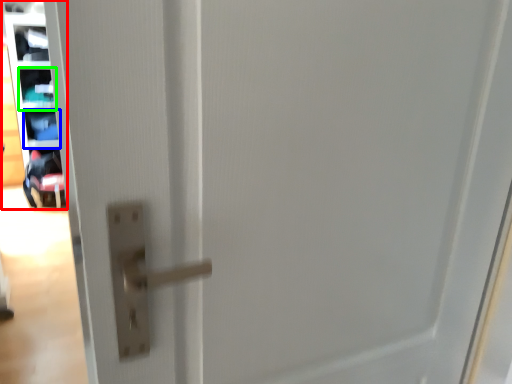
Question: Which object is positioned farthest from shelf (highlighted by a red box)? Select from shelf (highlighted by a blue box) and shelf (highlighted by a green box).

Choices:
 (A) shelf
 (B) shelf

Answer: (A)